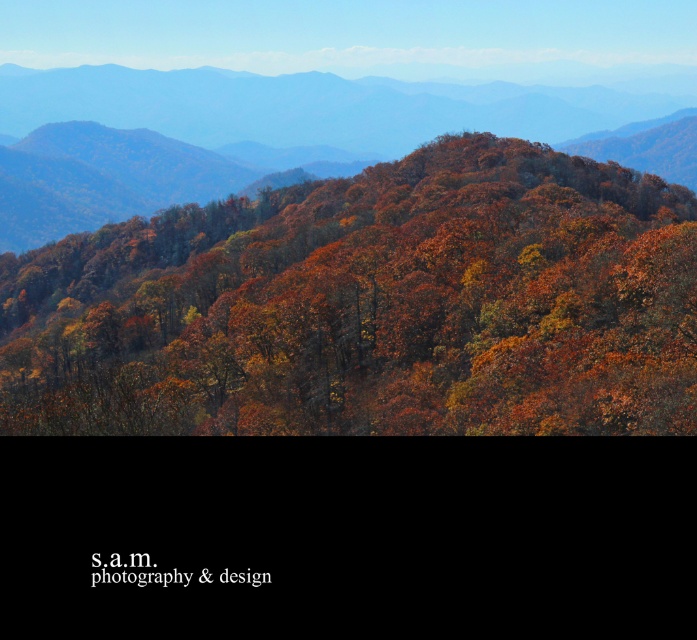
Looking at this image, you are a hiker standing at the edge of the forest. You see autumn leaves at center and autumn foliage at center. Which one is closer to you?

The autumn leaves at center are closer to you because they are positioned below the autumn foliage at center, which places them lower in the visual hierarchy, indicating proximity.

You are standing in the autumn landscape and notice two elements at the center of the image. One is labeled autumn leaves at center and the other autumn foliage at center. Based on their positions, which one is located to the right?

The autumn leaves at center are to the right of autumn foliage at center.